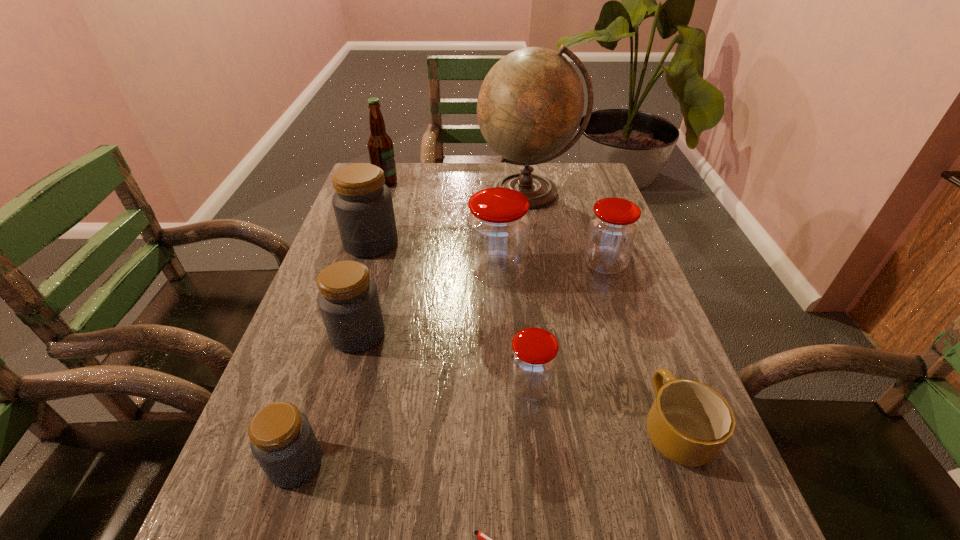
Locate an element on the screen. The width and height of the screenshot is (960, 540). the second nearest jar is located at coordinates (533, 361).

Where is `the smallest gray jar`? This screenshot has width=960, height=540. the smallest gray jar is located at coordinates (282, 440).

Where is `the nearest jar`? This screenshot has width=960, height=540. the nearest jar is located at coordinates [282, 440].

Image resolution: width=960 pixels, height=540 pixels. What are the coordinates of `tan mug` in the screenshot? It's located at (689, 423).

Find the location of a particular element. mug is located at coordinates (689, 423).

At what (x,y) coordinates should I click in order to perform the action: click on free space located on the front-facing side of the globe. Please return your answer as a coordinate pair (x, y). Looking at the image, I should click on 544,295.

Identify the location of vacant space situated on the label of the beer bottle. (481, 183).

This screenshot has width=960, height=540. I want to click on vacant space located on the surface of the biggest gray jar near the warning symbol, so click(338, 350).

Find the location of `free region located 0.300m on the front of the biggest red jar`. free region located 0.300m on the front of the biggest red jar is located at coordinates (502, 394).

Locate an element on the screen. The image size is (960, 540). vacant space situated on the left of the rightmost red jar is located at coordinates (498, 264).